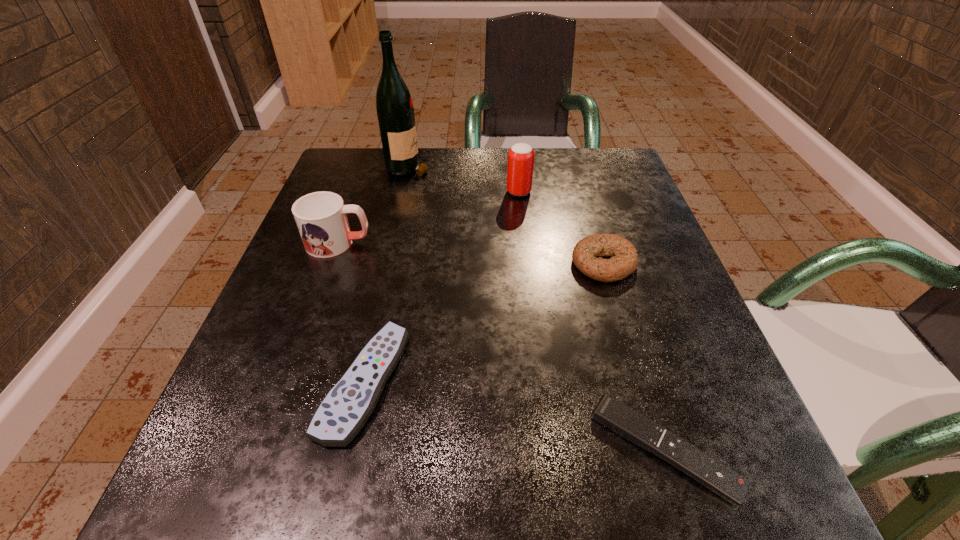
Locate an element on the screen. Image resolution: width=960 pixels, height=540 pixels. mug that is at the left edge is located at coordinates (321, 217).

Where is `remote control located at the left edge`? Image resolution: width=960 pixels, height=540 pixels. remote control located at the left edge is located at coordinates (345, 409).

Find the location of a particular element. This screenshot has width=960, height=540. bagel situated at the right edge is located at coordinates (624, 259).

At what (x,y) coordinates should I click in order to perform the action: click on remote control situated at the right edge. Please return your answer as a coordinate pair (x, y). Image resolution: width=960 pixels, height=540 pixels. Looking at the image, I should click on (630, 424).

Image resolution: width=960 pixels, height=540 pixels. Find the location of `object at the far left corner`. object at the far left corner is located at coordinates (395, 111).

This screenshot has height=540, width=960. Identify the location of object at the near right corner. (630, 424).

You are a GUI agent. You are given a task and a screenshot of the screen. Output one action in this format:
    pyautogui.click(x=<x>, y=<y>)
    Task: Click on the free space at the far edge
    The height and width of the screenshot is (540, 960).
    Given the screenshot: What is the action you would take?
    pyautogui.click(x=497, y=157)

The height and width of the screenshot is (540, 960). In order to click on vacant area at the near edge of the desktop in this screenshot , I will do `click(360, 502)`.

This screenshot has width=960, height=540. In the image, there is a desktop. In order to click on free space at the left edge in this screenshot , I will do tap(263, 329).

Where is `vacant space at the right edge`? The height and width of the screenshot is (540, 960). vacant space at the right edge is located at coordinates (706, 346).